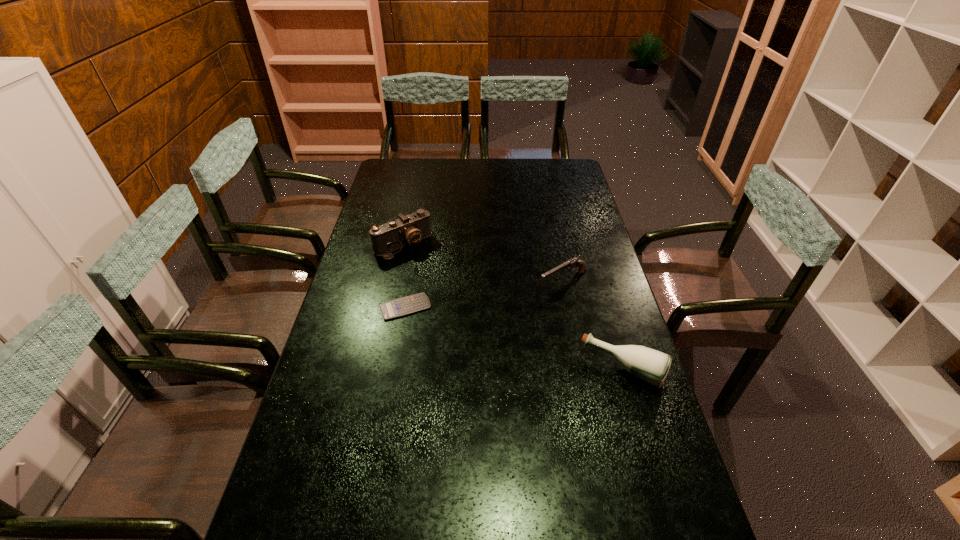
Locate an element on the screen. free spot on the desktop that is between the calculator and the nearest object and is positioned aiming along the barrel of the gun is located at coordinates (482, 328).

Image resolution: width=960 pixels, height=540 pixels. Identify the location of free spot on the desktop that is between the shortest object and the nearest object and is positioned on the front-facing side of the camera. (480, 328).